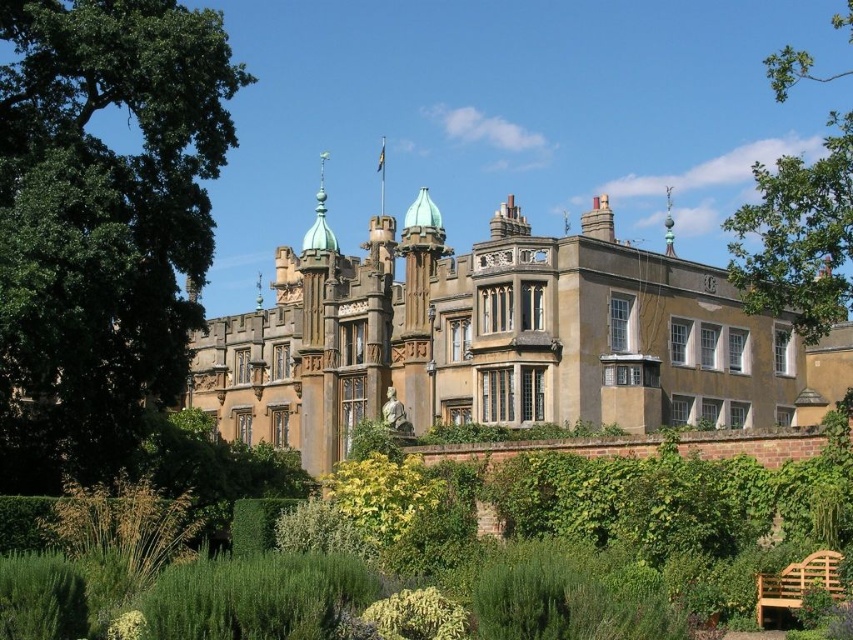
Who is lower down, golden stone palace at center or light brown wooden bench at lower right?

Positioned lower is light brown wooden bench at lower right.

Between golden stone palace at center and light brown wooden bench at lower right, which one appears on the left side from the viewer's perspective?

golden stone palace at center

What do you see at coordinates (494, 337) in the screenshot? The image size is (853, 640). I see `golden stone palace at center` at bounding box center [494, 337].

Identify the location of golden stone palace at center. Image resolution: width=853 pixels, height=640 pixels. (494, 337).

Is green leafy hedge at center above light brown wooden bench at lower right?

Indeed, green leafy hedge at center is positioned over light brown wooden bench at lower right.

Which is in front, point (341, 556) or point (782, 600)?

Point (782, 600)

At what (x,y) coordinates should I click in order to perform the action: click on green leafy hedge at center. Please return your answer as a coordinate pair (x, y). Looking at the image, I should click on (601, 500).

Does golden stone palace at center have a greater height compared to green leafy hedge at center?

Yes.

Does golden stone palace at center have a lesser height compared to green leafy hedge at center?

No, golden stone palace at center is not shorter than green leafy hedge at center.

Is point (347, 262) less distant than point (48, 580)?

No.

Where is `golden stone palace at center`? The image size is (853, 640). golden stone palace at center is located at coordinates (494, 337).